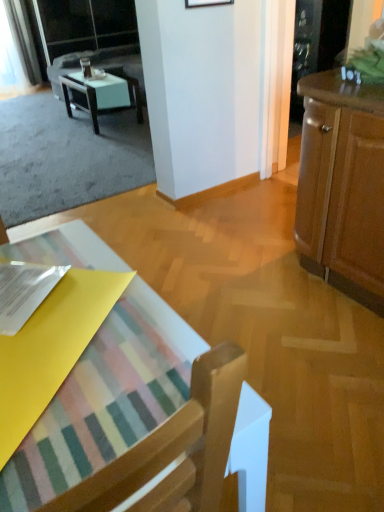
I want to click on vacant position to the left of wooden cabinet at right, so click(x=241, y=282).